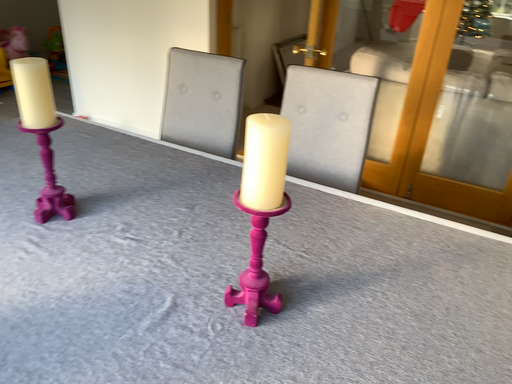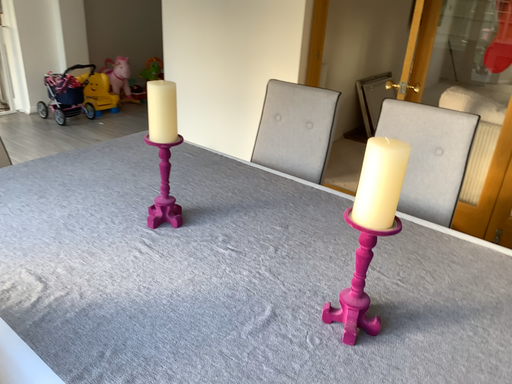
Question: How did the camera likely rotate when shooting the video?

Choices:
 (A) rotated left
 (B) rotated right

Answer: (A)